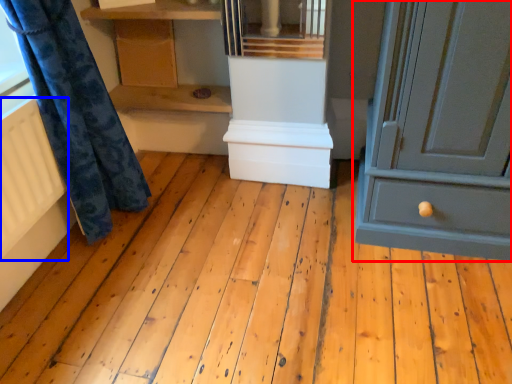
Question: Which object is further to the camera taking this photo, chest of drawers (highlighted by a red box) or radiator (highlighted by a blue box)?

Choices:
 (A) chest of drawers
 (B) radiator

Answer: (B)